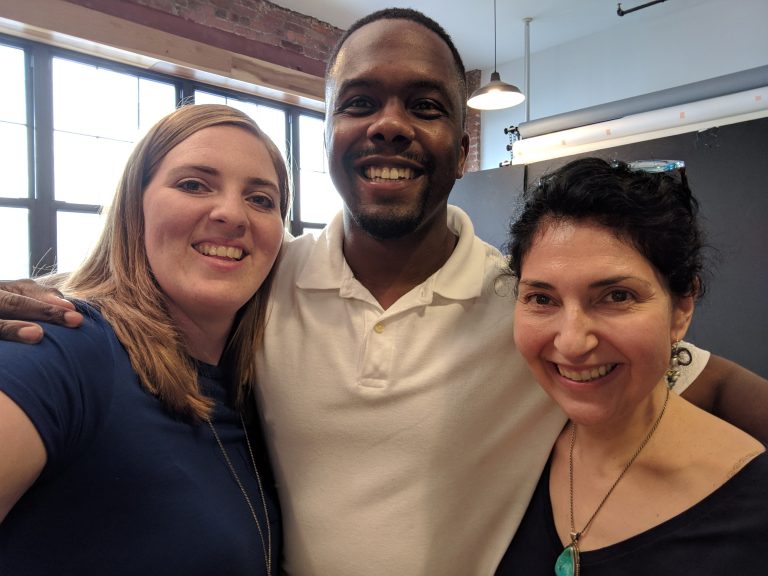
You are a GUI agent. You are given a task and a screenshot of the screen. Output one action in this format:
    pyautogui.click(x=<x>, y=<y>)
    Task: Click on the windows
    The height and width of the screenshot is (576, 768).
    Given the screenshot: What is the action you would take?
    pyautogui.click(x=20, y=107), pyautogui.click(x=88, y=140), pyautogui.click(x=276, y=112)